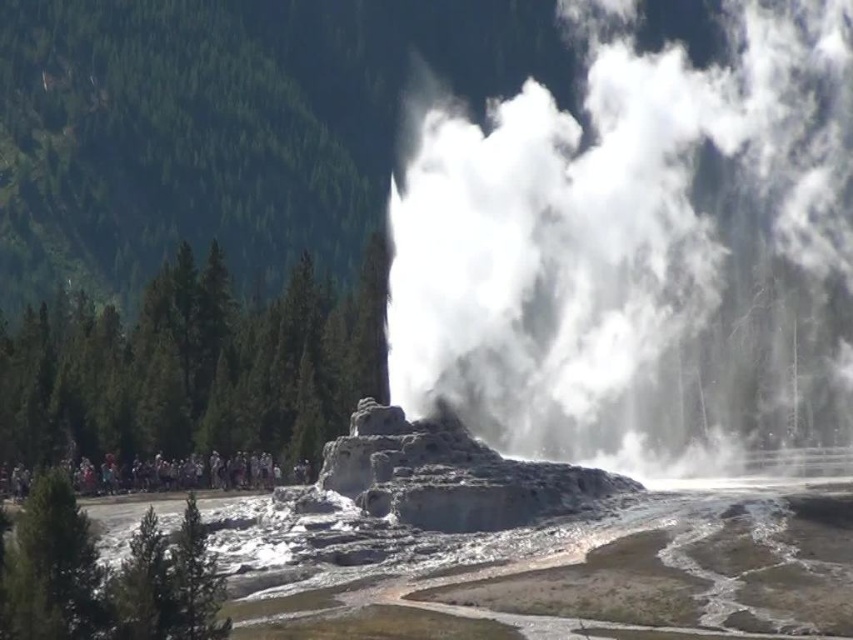
Does white vapor at center appear under multicolored clothing at lower left?

No.

Who is shorter, white vapor at center or multicolored clothing at lower left?

With less height is multicolored clothing at lower left.

Which is in front, point (709, 112) or point (189, 458)?

Point (189, 458)

Where is `white vapor at center`? The height and width of the screenshot is (640, 853). white vapor at center is located at coordinates (637, 252).